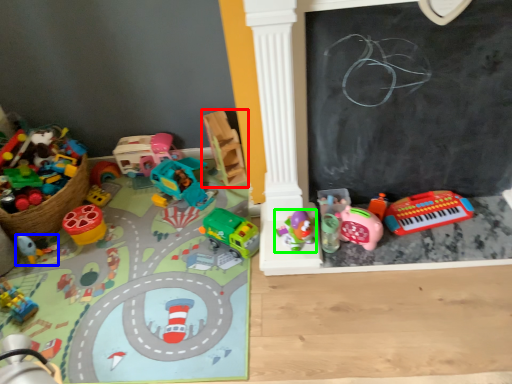
Question: Based on their relative distances, which object is farther from toy (highlighted by a red box)? Choose from toy (highlighted by a blue box) and toy (highlighted by a green box).

Choices:
 (A) toy
 (B) toy

Answer: (A)